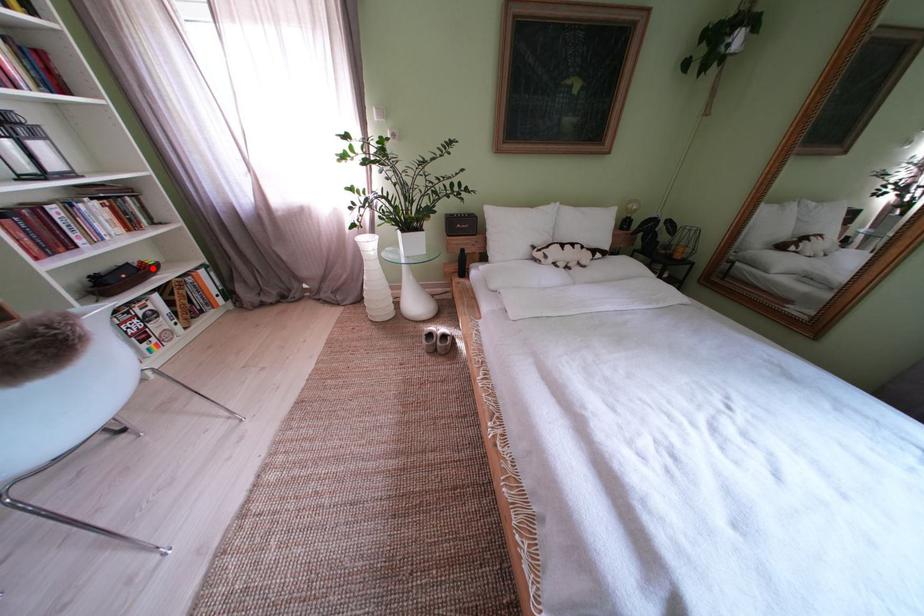
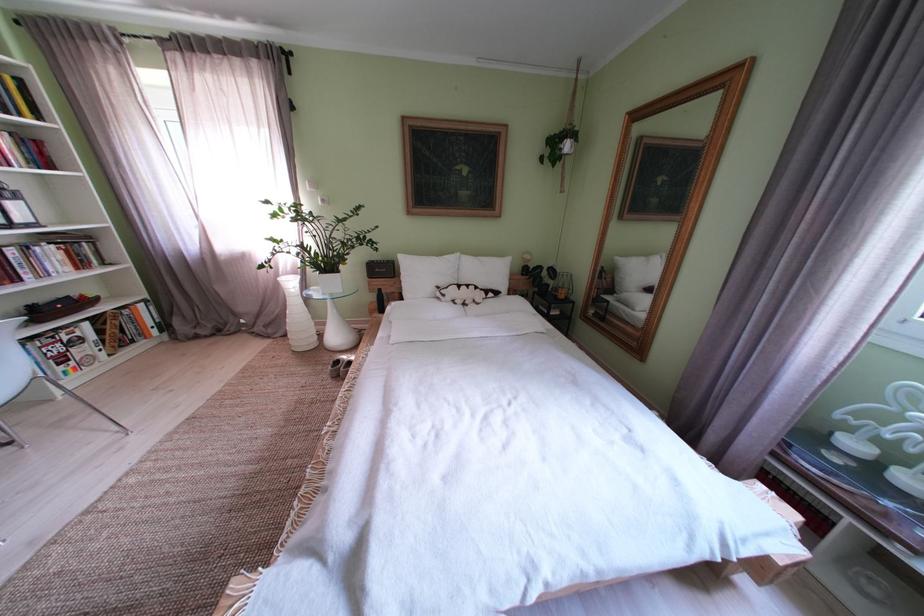
Locate, in the second image, the point that corresponds to the highlighted location in the first image.

(92, 302)